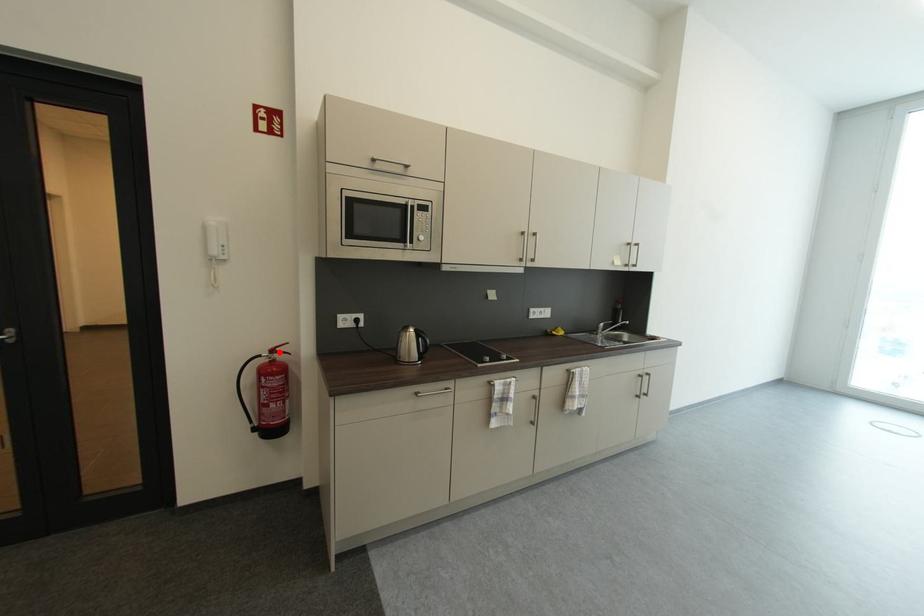
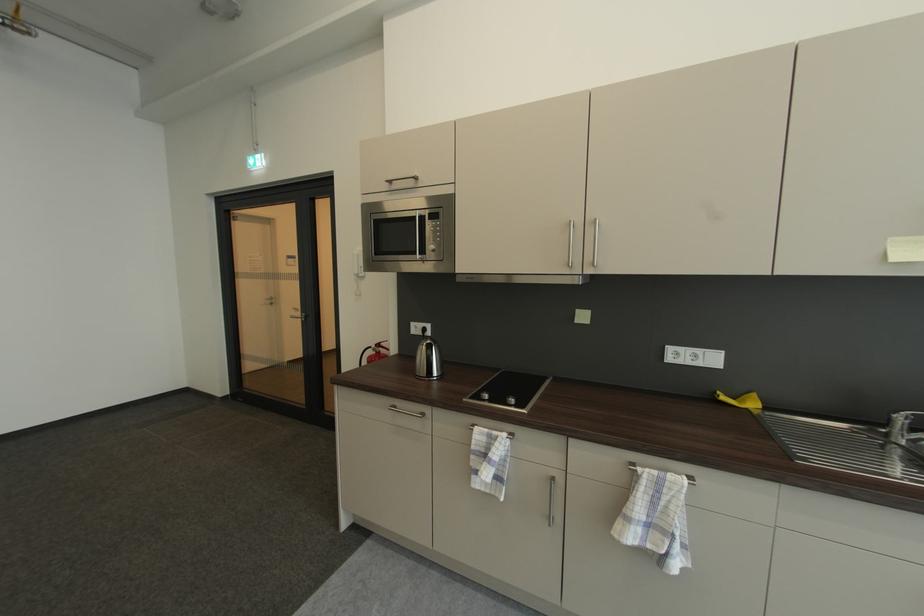
Locate, in the second image, the point that corresponds to the highlighted location in the first image.

(384, 347)